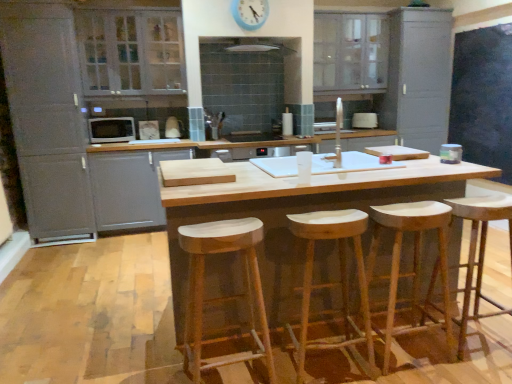
Where is `vacant area that is in front of matte gray cabinet at left, which is counted as the 1th cabinetry, starting from the left`? This screenshot has height=384, width=512. vacant area that is in front of matte gray cabinet at left, which is counted as the 1th cabinetry, starting from the left is located at coordinates (62, 254).